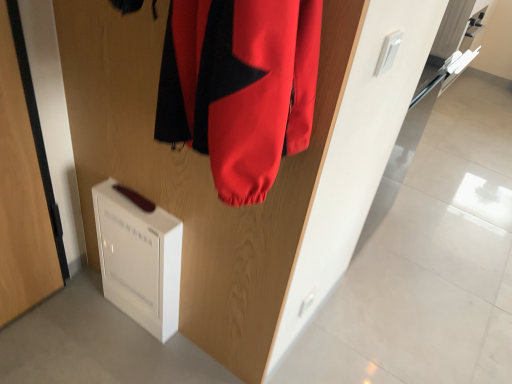
Question: Is white plastic air purifier at lower left surrounding wooden door at center, placed as the 1th door when sorted from right to left?

Choices:
 (A) yes
 (B) no

Answer: (B)

Question: From the image's perspective, would you say white plastic air purifier at lower left is positioned over wooden door at center, the 2th door in the left-to-right sequence?

Choices:
 (A) no
 (B) yes

Answer: (A)

Question: Is white plastic air purifier at lower left thinner than wooden door at center, placed as the 1th door when sorted from right to left?

Choices:
 (A) yes
 (B) no

Answer: (B)

Question: Is wooden door at center, the 2th door in the left-to-right sequence, at the back of white plastic air purifier at lower left?

Choices:
 (A) no
 (B) yes

Answer: (B)

Question: Is white plastic air purifier at lower left bigger than wooden door at center, the 2th door in the left-to-right sequence?

Choices:
 (A) yes
 (B) no

Answer: (B)

Question: Is white plastic air purifier at lower left at the right side of wooden door at center, placed as the 1th door when sorted from right to left?

Choices:
 (A) yes
 (B) no

Answer: (B)

Question: Is white plastic air purifier at lower left directly adjacent to white matte door at lower left, which is counted as the first door, starting from the left?

Choices:
 (A) yes
 (B) no

Answer: (B)

Question: Is white plastic air purifier at lower left positioned far away from white matte door at lower left, the 2th door positioned from the right?

Choices:
 (A) no
 (B) yes

Answer: (A)

Question: From a real-world perspective, is white plastic air purifier at lower left located beneath white matte door at lower left, which is counted as the first door, starting from the left?

Choices:
 (A) yes
 (B) no

Answer: (A)

Question: Does white plastic air purifier at lower left have a lesser height compared to white matte door at lower left, the 2th door positioned from the right?

Choices:
 (A) yes
 (B) no

Answer: (A)

Question: Does white plastic air purifier at lower left have a greater width compared to white matte door at lower left, which is counted as the first door, starting from the left?

Choices:
 (A) no
 (B) yes

Answer: (A)

Question: Does white plastic air purifier at lower left have a greater height compared to white matte door at lower left, which is counted as the first door, starting from the left?

Choices:
 (A) yes
 (B) no

Answer: (B)

Question: Is the surface of wooden door at center, the 2th door in the left-to-right sequence, in direct contact with white plastic air purifier at lower left?

Choices:
 (A) no
 (B) yes

Answer: (A)